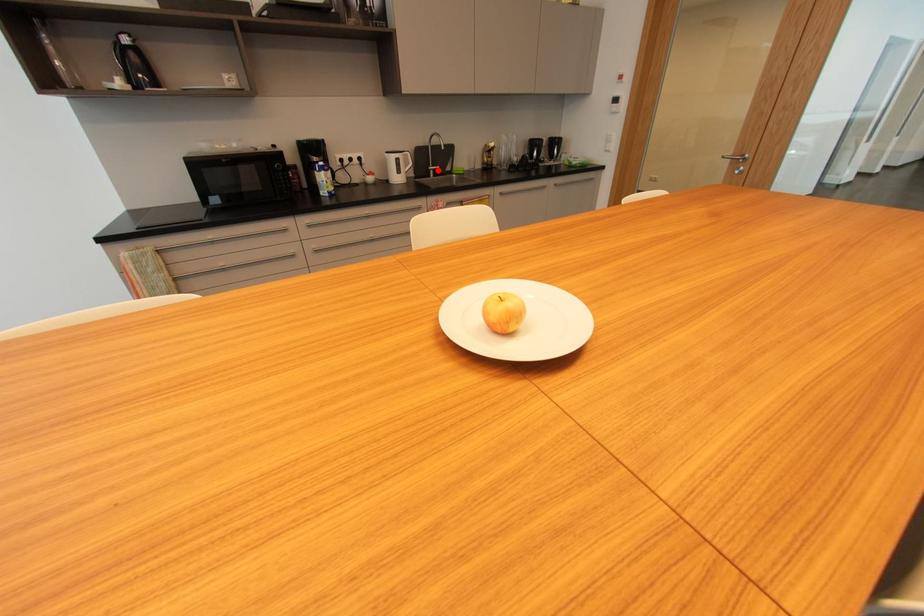
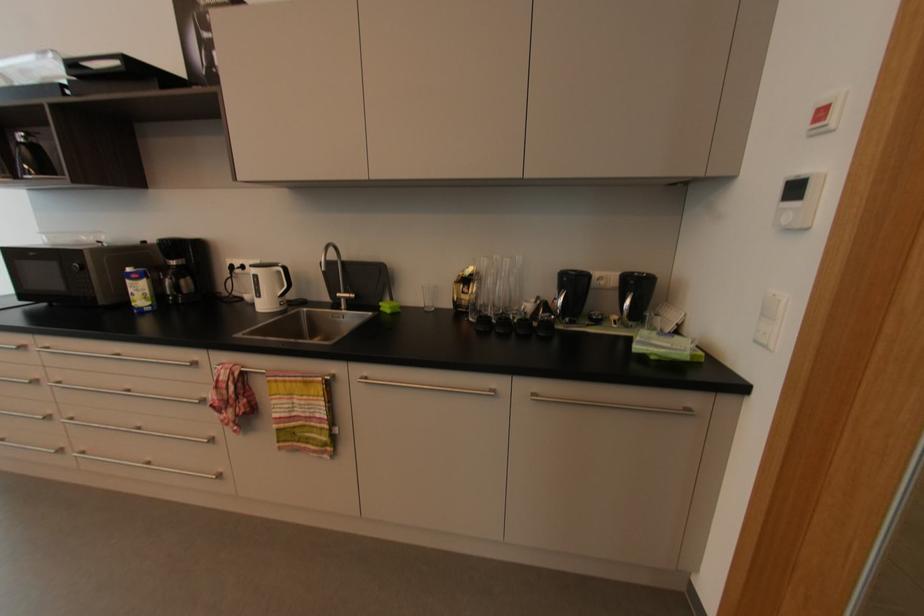
Question: I am providing you with two images of the same scene from different viewpoints. Given a red point in image1, look at the same physical point in image2. Is it:

Choices:
 (A) Closer to the viewpoint
 (B) Farther from the viewpoint

Answer: (B)